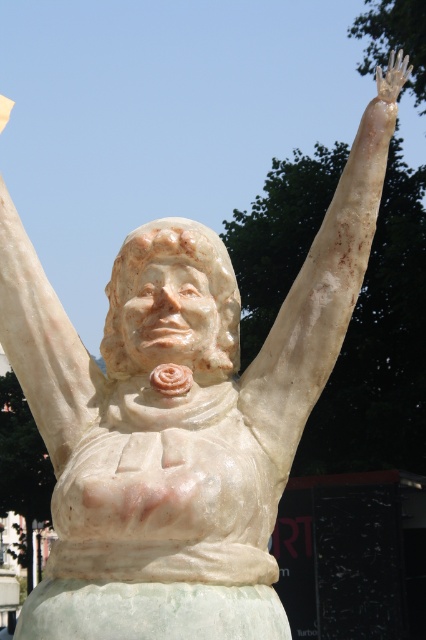
You are an art conservator examining the statue. You notice the white marble statue arm at upper center and the white marble hand at upper right. Which part of the statue is shorter in height?

The white marble statue arm at upper center is shorter in height compared to the white marble hand at upper right.

You are an art restorer examining the statue. You need to check the positioning of the arms. Which arm is located to the right side of the other? Specifically, is the white marble arm at upper right positioned to the right of the white marble statue arm at upper center?

The white marble arm at upper right is positioned to the right of the white marble statue arm at upper center according to the description.

You are a sculptor standing at the base of the statue and want to place a small golden plaque at the exact midpoint between the statue and the white marble arm at upper right. What coordinates should you aim for?

The white marble arm at upper right is located at coordinates point (319, 298). To find the midpoint between the statue and the arm, you would calculate the average of their coordinates. Assuming the statue is at the origin point (0, 0), the midpoint would be at (159, 148). However, since the statue itself occupies space, the actual midpoint might require adjusting based on the statue base dimensions.